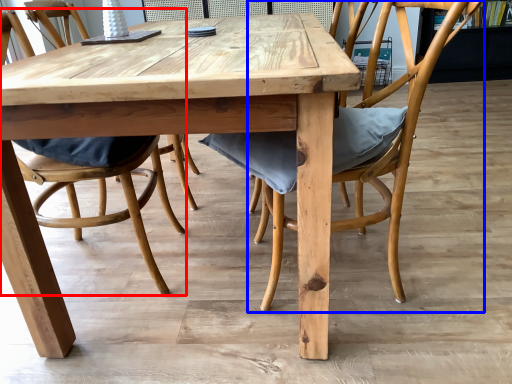
Question: Which object is closer to the camera taking this photo, chair (highlighted by a red box) or chair (highlighted by a blue box)?

Choices:
 (A) chair
 (B) chair

Answer: (B)